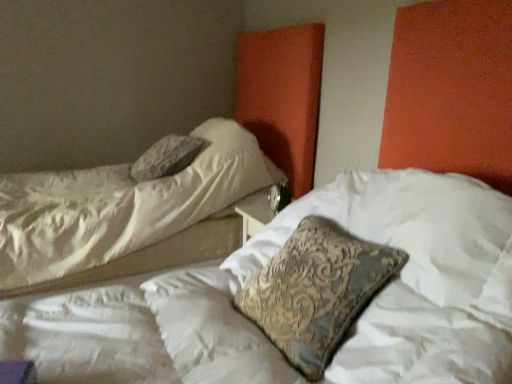
What is the approximate height of velvet-patterned pillow at center?

It is 25.44 inches.

Locate an element on the screen. Image resolution: width=512 pixels, height=384 pixels. velvet-patterned pillow at center is located at coordinates (316, 291).

Measure the distance between velvet-patterned pillow at center and camera.

velvet-patterned pillow at center is 3.30 feet away from camera.

The height and width of the screenshot is (384, 512). Describe the element at coordinates (316, 291) in the screenshot. I see `velvet-patterned pillow at center` at that location.

Where is `velvet-patterned pillow at center`? velvet-patterned pillow at center is located at coordinates (316, 291).